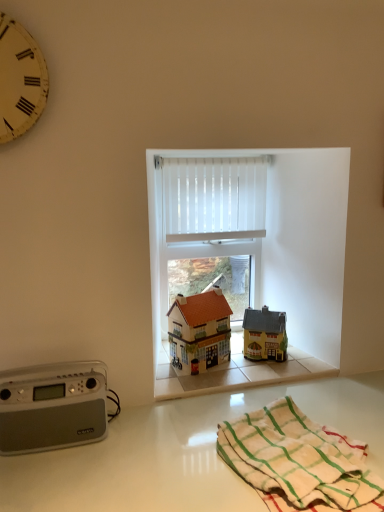
The width and height of the screenshot is (384, 512). In order to click on vacant area located to the right-hand side of gray plastic stereo at lower left in this screenshot , I will do `click(140, 443)`.